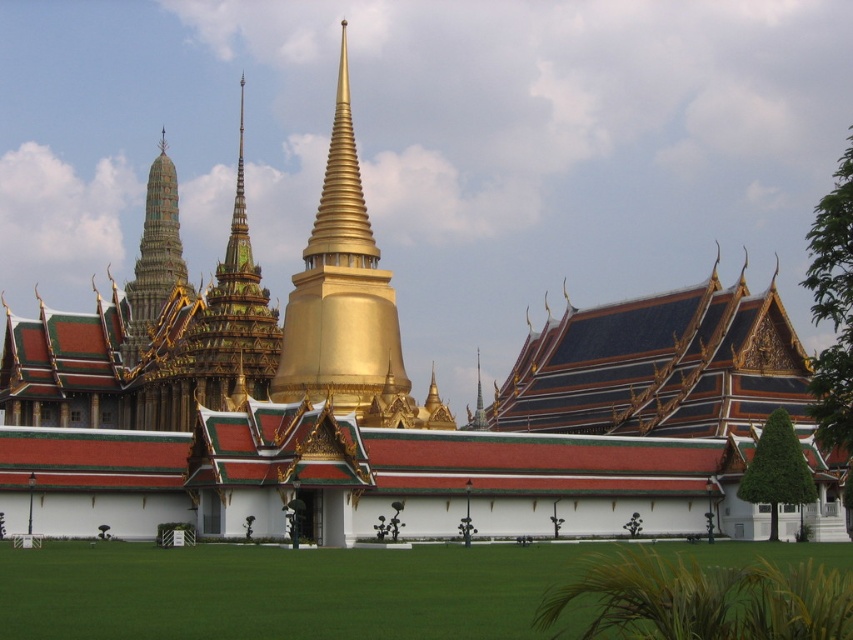
You are standing at the entrance of the temple complex and want to take a photo of the point at coordinates (x=350, y=163). Your camera has a maximum focus range of 100 meters. Will the camera be able to focus on the point?

The point at coordinates (x=350, y=163) is 102.42 meters away from the camera, which exceeds the maximum focus range of 100 meters. Therefore, the camera will not be able to focus on the point.

Based on the scene description, where is the gold polished spire at center located in terms of coordinates?

The gold polished spire at center is located at point coordinates of (x=341, y=292).

You are an architect analyzing the temple complex. You need to determine which spire is taller between the gold polished spire at center and the green textured spire at upper left. Based on the scene, which one is taller?

The gold polished spire at center is taller than the green textured spire at upper left according to the description.